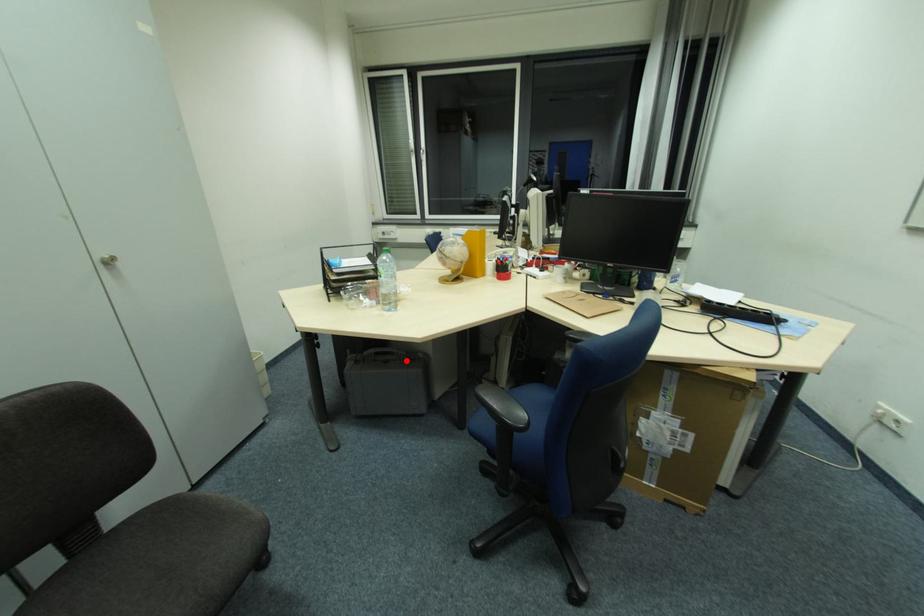
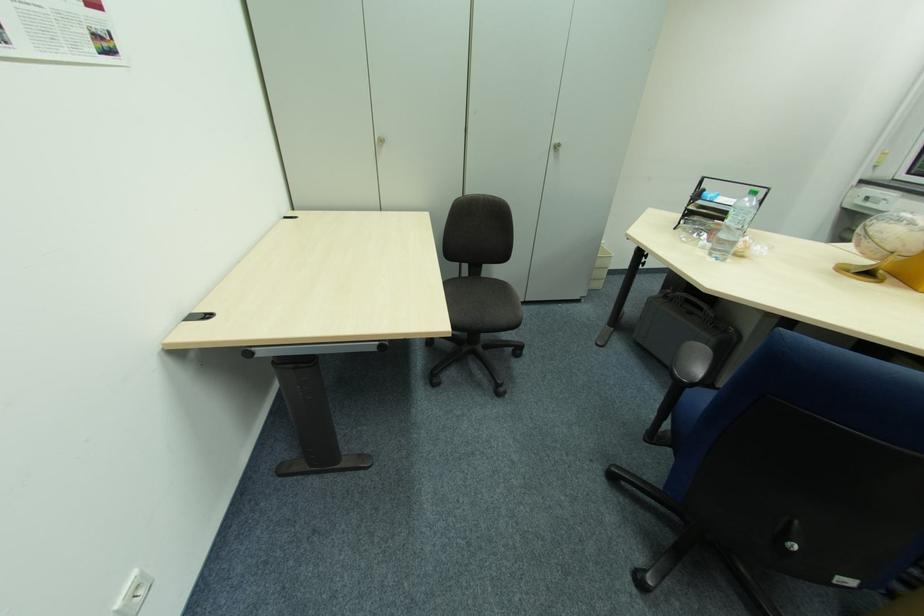
Question: I am providing you with two images of the same scene from different viewpoints. A red point is marked on the first image. At the location where the point appears in image 1, is it still visible in image 2?

Choices:
 (A) Yes
 (B) No

Answer: (A)